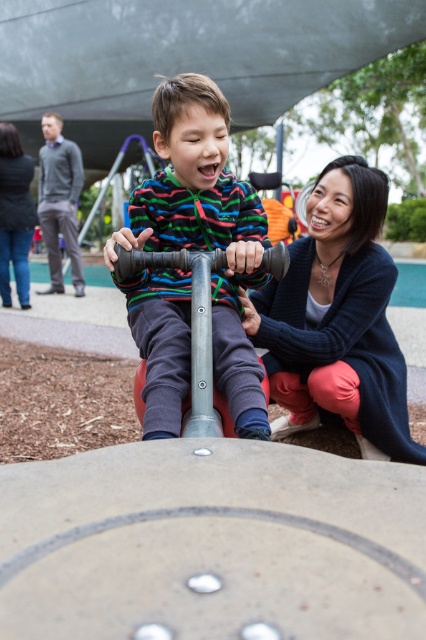
You are a parent at the playground and want to place a small toy on the ground between the matte plastic scooter at center and the blue sweater at center. Which object should you place it closer to so that the toy is still visible from above without being blocked by either object?

The matte plastic scooter at center is not as tall as the blue sweater at center, so you should place the toy closer to the blue sweater at center to avoid blocking it from above.

You are a parent at the playground and see your child playing on the seesaw. You want to retrieve the matte plastic scooter at center to give to them. Can you reach it without moving from where you are crouched next to the dark blue sweater at lower right?

The matte plastic scooter at center is in front of the dark blue sweater at lower right, so yes, you can reach it without moving from your current position next to the dark blue sweater at lower right.